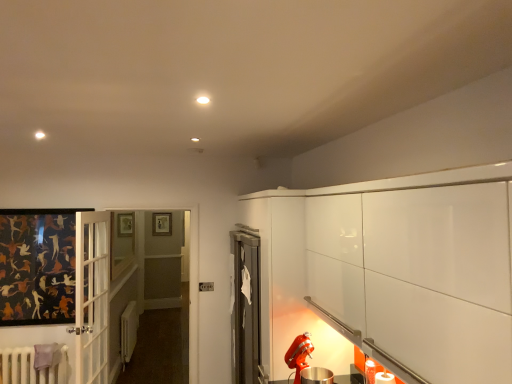
Question: Is white matte radiator at lower left, the first radiator positioned from the back, in contact with wooden picture frame at upper center?

Choices:
 (A) yes
 (B) no

Answer: (B)

Question: Would you say wooden picture frame at upper center is part of white matte radiator at lower left, marked as the 2th radiator in a front-to-back arrangement,'s contents?

Choices:
 (A) yes
 (B) no

Answer: (B)

Question: Considering the relative positions of white matte radiator at lower left, marked as the 2th radiator in a front-to-back arrangement, and wooden picture frame at upper center in the image provided, is white matte radiator at lower left, marked as the 2th radiator in a front-to-back arrangement, in front of wooden picture frame at upper center?

Choices:
 (A) yes
 (B) no

Answer: (A)

Question: From the image's perspective, would you say white matte radiator at lower left, the first radiator positioned from the back, is shown under wooden picture frame at upper center?

Choices:
 (A) yes
 (B) no

Answer: (A)

Question: Are white matte radiator at lower left, marked as the 2th radiator in a front-to-back arrangement, and wooden picture frame at upper center far apart?

Choices:
 (A) no
 (B) yes

Answer: (B)

Question: Is white matte radiator at lower left, the first radiator positioned from the back, facing towards wooden picture frame at upper center?

Choices:
 (A) no
 (B) yes

Answer: (A)

Question: Is white matte radiator at lower left, marked as the 2th radiator in a front-to-back arrangement, outside of white painted radiator at lower left, arranged as the 1th radiator when viewed from the front?

Choices:
 (A) yes
 (B) no

Answer: (A)

Question: Does white matte radiator at lower left, the first radiator positioned from the back, have a lesser height compared to white painted radiator at lower left, the 2th radiator from the back?

Choices:
 (A) no
 (B) yes

Answer: (A)

Question: Does white matte radiator at lower left, the first radiator positioned from the back, lie in front of white painted radiator at lower left, arranged as the 1th radiator when viewed from the front?

Choices:
 (A) yes
 (B) no

Answer: (B)

Question: Does white matte radiator at lower left, the first radiator positioned from the back, contain white painted radiator at lower left, arranged as the 1th radiator when viewed from the front?

Choices:
 (A) yes
 (B) no

Answer: (B)

Question: Is white matte radiator at lower left, marked as the 2th radiator in a front-to-back arrangement, to the left of white painted radiator at lower left, the 2th radiator from the back, from the viewer's perspective?

Choices:
 (A) no
 (B) yes

Answer: (A)

Question: Considering the relative sizes of white painted radiator at lower left, the 2th radiator from the back, and clear glass window at center in the image provided, is white painted radiator at lower left, the 2th radiator from the back, bigger than clear glass window at center?

Choices:
 (A) no
 (B) yes

Answer: (A)